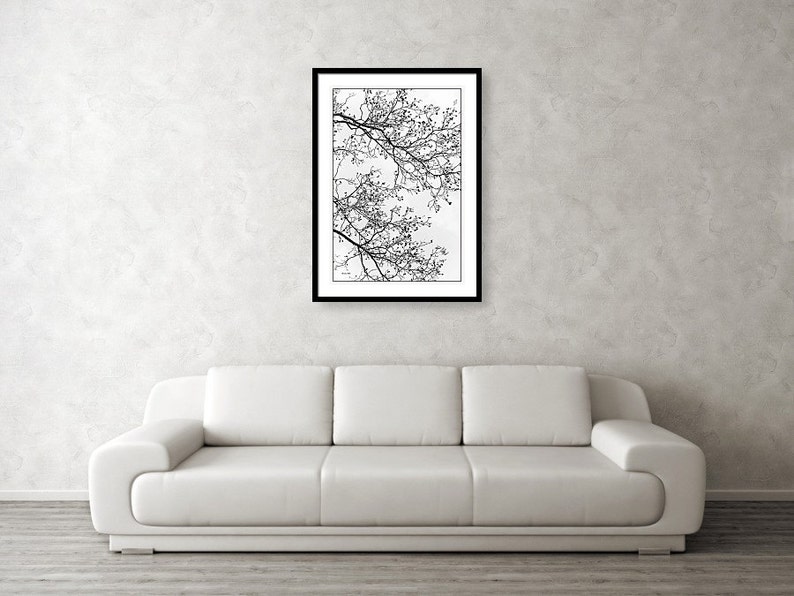
Identify the location of light shining on wall. This screenshot has width=794, height=596. (52, 380), (48, 276), (71, 46).